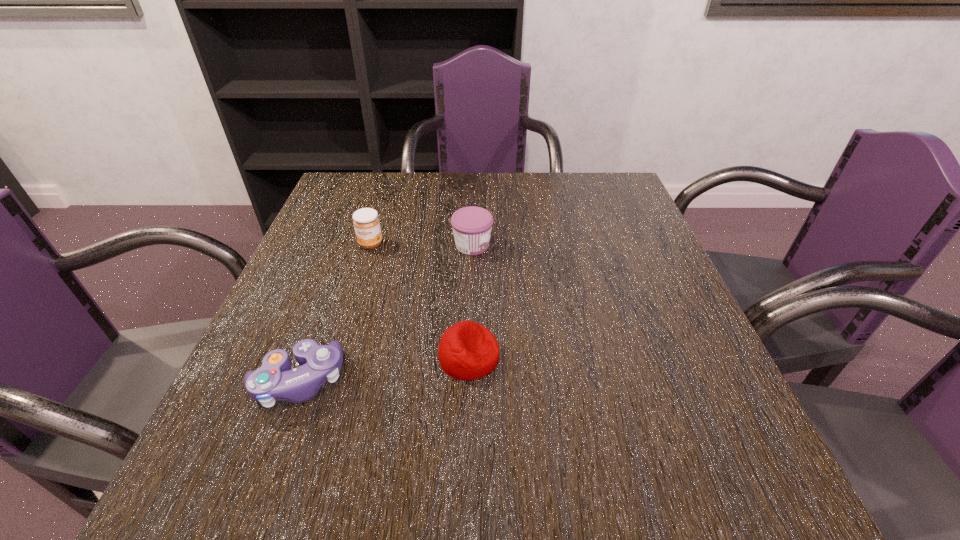
Locate an element on the screen. The image size is (960, 540). vacant space that satisfies the following two spatial constraints: 1. on the seat area of the shortest object; 2. on the front side of the control is located at coordinates (468, 381).